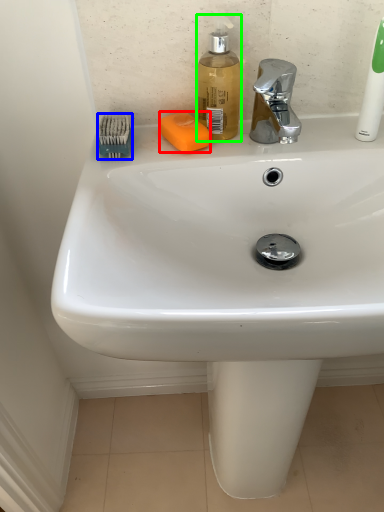
Question: Which object is the closest to the soap (highlighted by a red box)? Choose among these: brush (highlighted by a blue box) or soap dispenser (highlighted by a green box).

Choices:
 (A) brush
 (B) soap dispenser

Answer: (B)